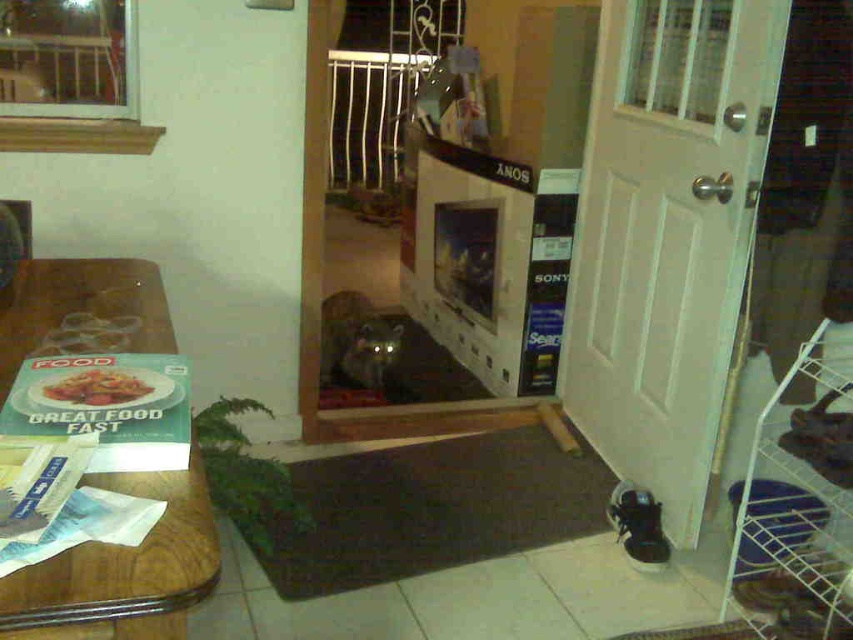
You are trying to place a matte paper book at left on the wooden table at left. Will it fit?

The wooden table at left might be wider than matte paper book at left, so there is a possibility that the matte paper book at left will fit on the wooden table at left.

You are standing in the hallway and want to move from the point at coordinates point (724, 100) to the point at coordinates point (154, 284). Can you walk directly between them without any obstacles?

Point (724, 100) is behind point (154, 284), so you cannot walk directly between them without going around the obstacle in front.